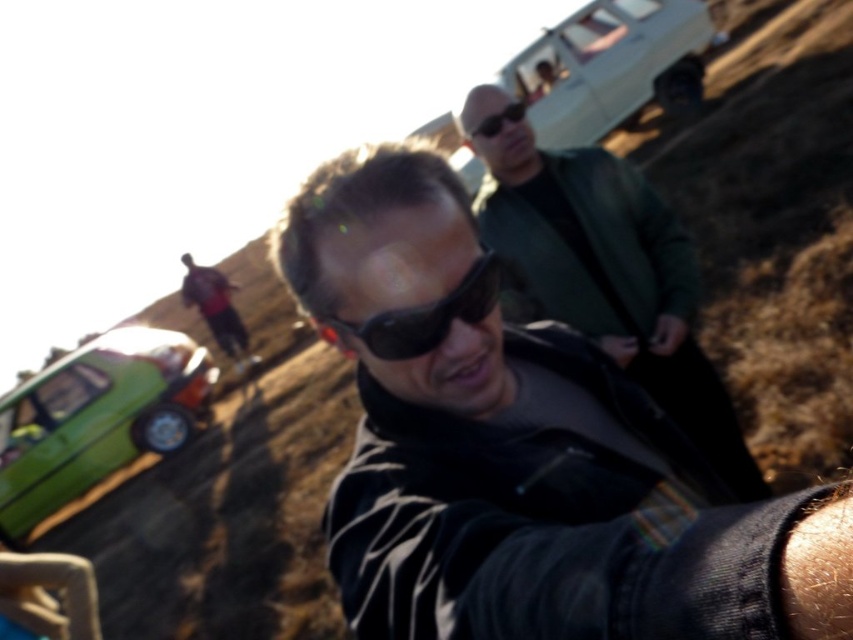
Which is behind, point (70, 461) or point (215, 333)?

Positioned behind is point (215, 333).

Does point (33, 515) come closer to viewer compared to point (225, 292)?

Yes.

Find the location of a particular element. green matte car at lower left is located at coordinates (96, 419).

Does dark green leather jacket at upper center have a greater width compared to red shirt at center?

Yes.

Is point (561, 186) positioned in front of point (210, 307)?

Yes, point (561, 186) is closer to viewer.

Where is `dark green leather jacket at upper center`? The width and height of the screenshot is (853, 640). dark green leather jacket at upper center is located at coordinates (605, 272).

Based on the photo, how distant is black matte sunglasses at center from green matte car at lower left?

black matte sunglasses at center and green matte car at lower left are 29.00 feet apart from each other.

You are a GUI agent. You are given a task and a screenshot of the screen. Output one action in this format:
    pyautogui.click(x=<x>, y=<y>)
    Task: Click on the black matte sunglasses at center
    This screenshot has height=640, width=853.
    Given the screenshot: What is the action you would take?
    pyautogui.click(x=523, y=451)